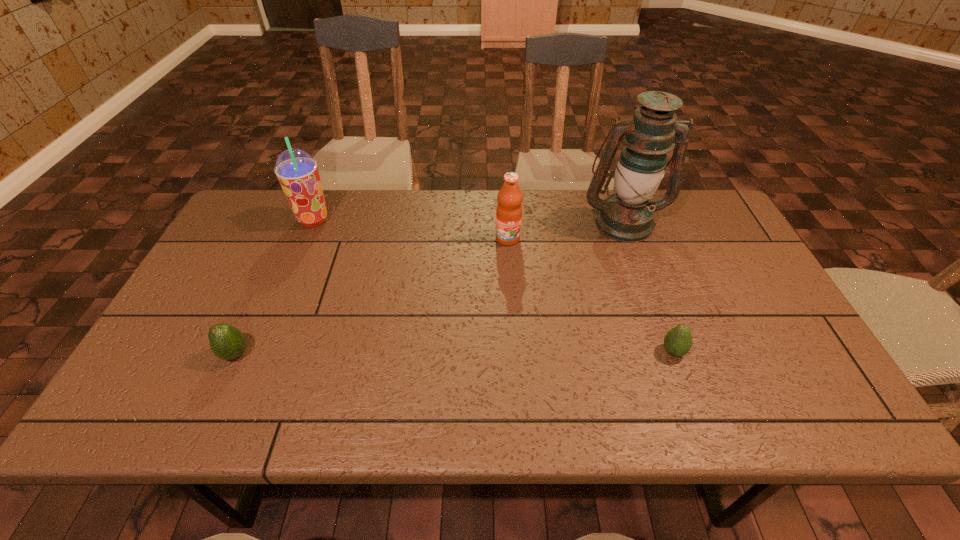
I want to click on the tallest object, so click(x=626, y=215).

Where is `the fourth shortest object`? the fourth shortest object is located at coordinates (297, 172).

At what (x,y) coordinates should I click in order to perform the action: click on the third tallest object. Please return your answer as a coordinate pair (x, y). Looking at the image, I should click on (509, 209).

Identify the location of the third object from left to right. This screenshot has height=540, width=960. [x=509, y=209].

What are the coordinates of `the left avocado` in the screenshot? It's located at (226, 342).

Locate an element on the screen. The height and width of the screenshot is (540, 960). the right avocado is located at coordinates (678, 341).

Image resolution: width=960 pixels, height=540 pixels. In order to click on vacant space located on the right of the tallest object in this screenshot , I will do `click(721, 222)`.

Find the location of a particular element. blank space located on the right of the smoothie is located at coordinates (455, 220).

I want to click on vacant space located 0.130m on the front label of the fruit juice, so click(x=511, y=279).

Where is `vacant area situated on the back of the left avocado`? The width and height of the screenshot is (960, 540). vacant area situated on the back of the left avocado is located at coordinates coord(283,251).